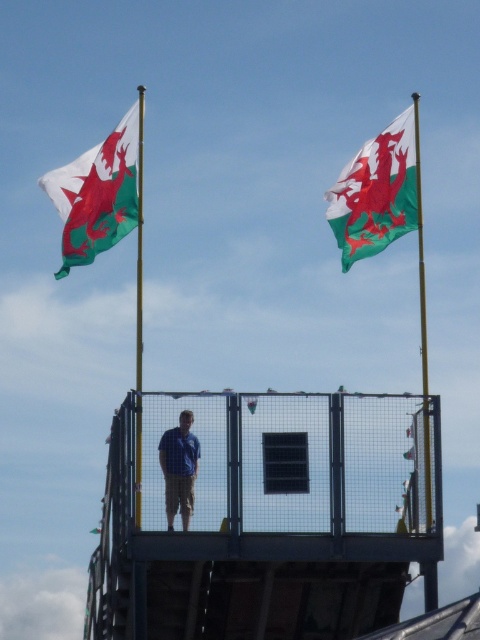
Is green and white fabric flag at upper right closer to the viewer compared to green/white fabric flag at upper left?

Yes, it is in front of green/white fabric flag at upper left.

Find the location of a particular element. This screenshot has height=640, width=480. green and white fabric flag at upper right is located at coordinates (376, 193).

Between point (376, 154) and point (112, 198), which one is positioned in front?

Positioned in front is point (112, 198).

Identify the location of green and white fabric flag at upper right. (376, 193).

Looking at this image, can you confirm if green and white fabric flag at upper right is positioned to the right of blue shirt at center?

Correct, you'll find green and white fabric flag at upper right to the right of blue shirt at center.

This screenshot has width=480, height=640. What are the coordinates of `green and white fabric flag at upper right` in the screenshot? It's located at (376, 193).

The image size is (480, 640). What do you see at coordinates (376, 193) in the screenshot?
I see `green and white fabric flag at upper right` at bounding box center [376, 193].

Find the location of a particular element. This screenshot has height=640, width=480. green and white fabric flag at upper right is located at coordinates (376, 193).

Does blue shirt at center have a lesser width compared to yellow metallic flag pole at right?

Correct, blue shirt at center's width is less than yellow metallic flag pole at right's.

Can you confirm if blue shirt at center is positioned above yellow metallic flag pole at right?

No.

Between point (164, 433) and point (432, 588), which one is positioned in front?

Point (164, 433) is in front.

Find the location of a particular element. The image size is (480, 640). blue shirt at center is located at coordinates (180, 468).